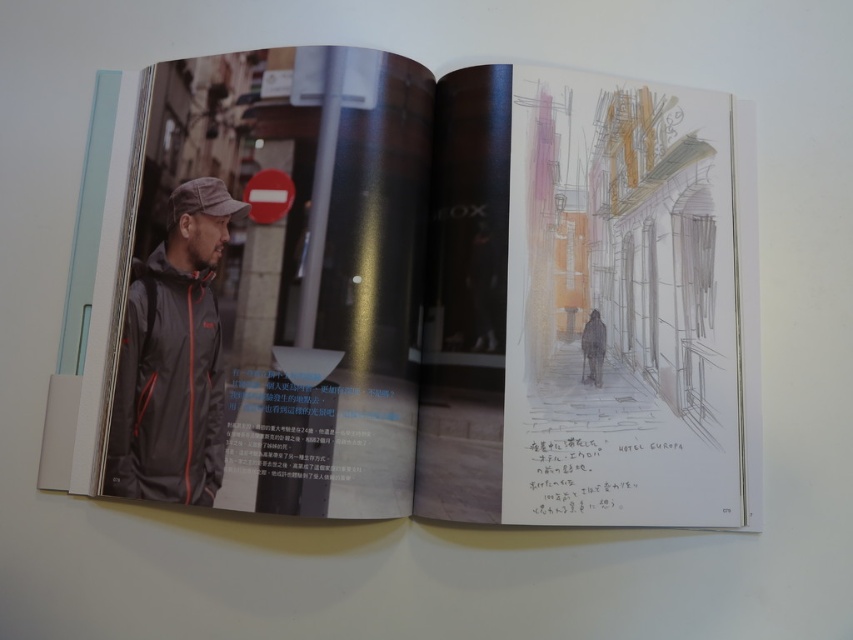
Is matte black jacket at left positioned behind dark gray matte jacket at left?

That is False.

Does matte black jacket at left have a smaller size compared to dark gray matte jacket at left?

Incorrect, matte black jacket at left is not smaller in size than dark gray matte jacket at left.

Image resolution: width=853 pixels, height=640 pixels. I want to click on matte black jacket at left, so click(x=430, y=296).

Where is `matte black jacket at left`? Image resolution: width=853 pixels, height=640 pixels. matte black jacket at left is located at coordinates (430, 296).